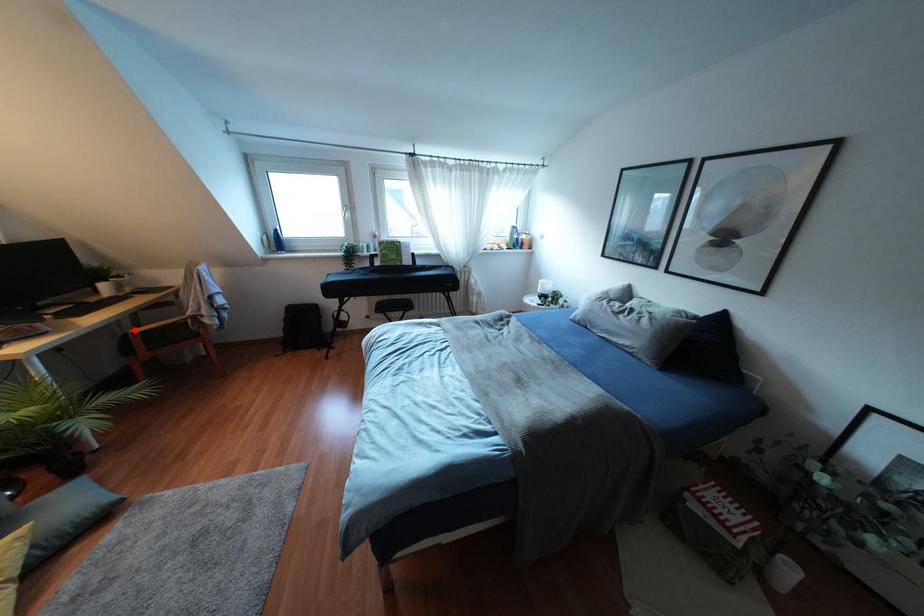
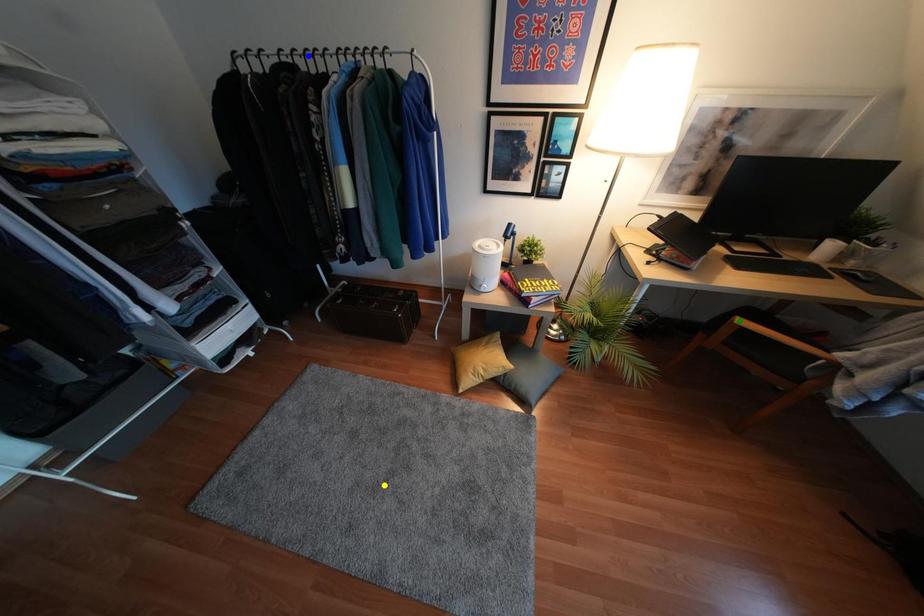
Question: I am providing you with two images of the same scene from different viewpoints. A red point is marked on the first image. You are given multiple points on the second image. Which point in image 2 is actually the same real-world point as the red point in image 1?

Choices:
 (A) yellow point
 (B) blue point
 (C) green point

Answer: (C)